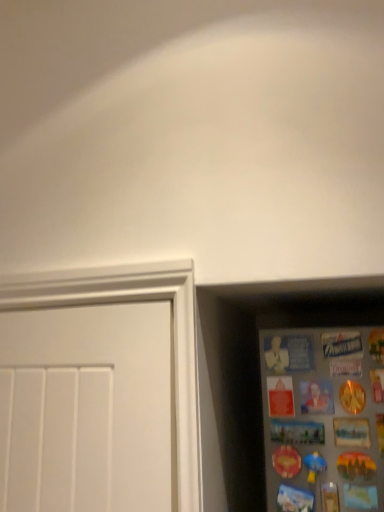
Image resolution: width=384 pixels, height=512 pixels. Describe the element at coordinates (323, 418) in the screenshot. I see `metallic silver magnets at right` at that location.

I want to click on metallic silver magnets at right, so tap(323, 418).

Identify the location of metallic silver magnets at right. (323, 418).